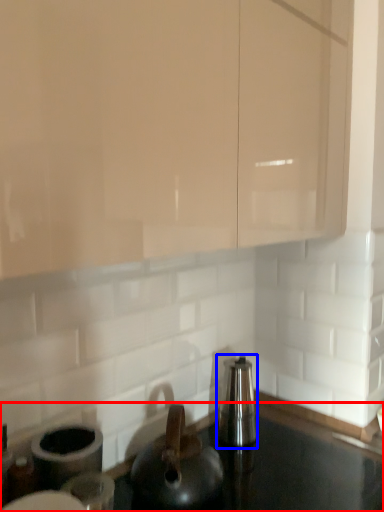
Question: Which point is further to the camera, countertop (highlighted by a red box) or appliance (highlighted by a blue box)?

Choices:
 (A) countertop
 (B) appliance

Answer: (B)